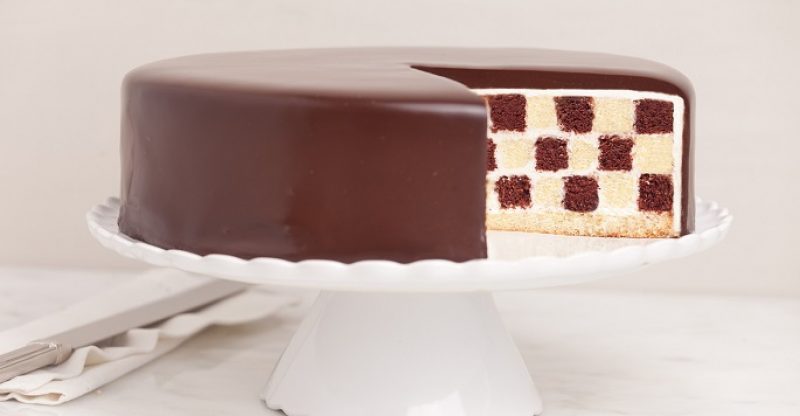
Where is `empty counter space to the left of napkin`? Image resolution: width=800 pixels, height=416 pixels. empty counter space to the left of napkin is located at coordinates (33, 294).